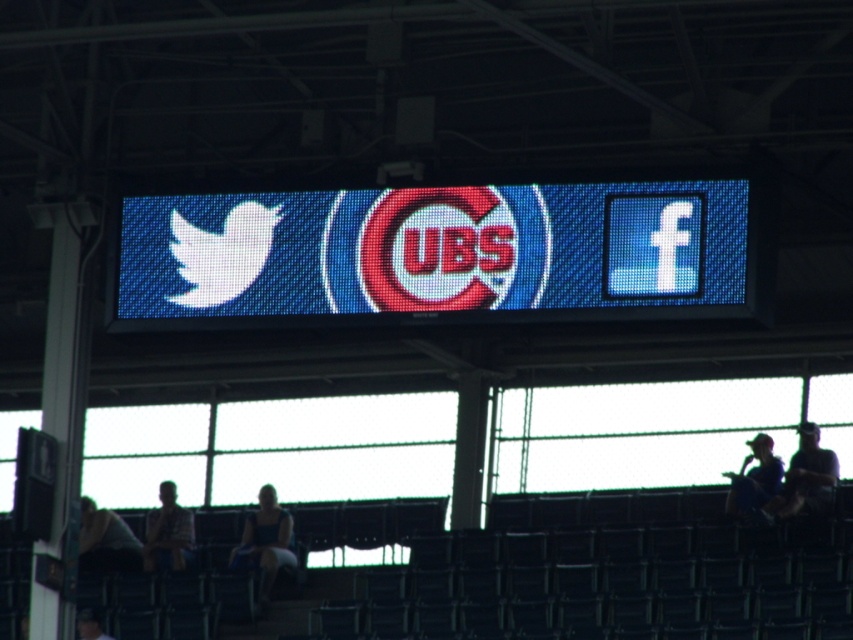
You are a photographer trying to capture a wide shot of the stadium scene. Your camera has a limited field of view. You notice the dark gray fabric at lower left and the dark blue shirt at lower right. Which object should you focus on to ensure both are visible in the frame without cropping?

The dark gray fabric at lower left is bigger than the dark blue shirt at lower right. To ensure both are visible without cropping, focus on the larger object, the dark gray fabric at lower left, as it requires more space in the frame.

You are a photographer at the stadium and want to capture the digital display board with the Chicago Cubs logo. You are currently standing at point (434, 253). Is the matte digital display at center visible from your current position?

The point (434, 253) is where the matte digital display at center is located, so yes, you are standing right at the matte digital display at center and can see it.

You are attending a Chicago Cubs game and notice two fans wearing the blue denim dress at lower center and the dark blue shirt at lower right. Which fan is sitting closer to the field?

The blue denim dress at lower center is below dark blue shirt at lower right, so the fan wearing the blue denim dress at lower center is sitting closer to the field.